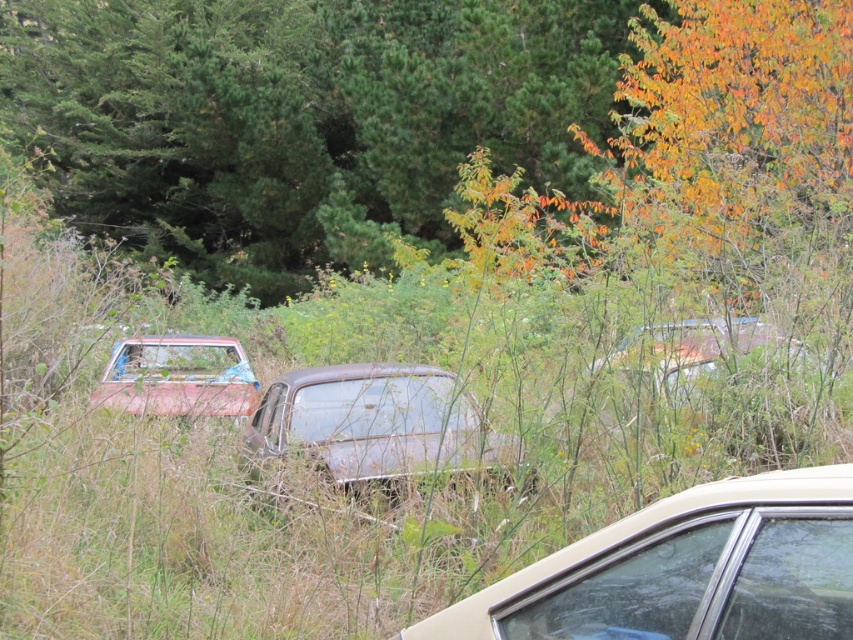
Question: Which object appears closest to the camera in this image?

Choices:
 (A) green matte tree at upper center
 (B) rusty metallic car at center
 (C) rusty metal car at left
 (D) metallic beige sedan at lower right

Answer: (D)

Question: Is rusty metallic car at center closer to camera compared to rusty metal car at left?

Choices:
 (A) no
 (B) yes

Answer: (B)

Question: Which point is closer to the camera taking this photo?

Choices:
 (A) (482, 435)
 (B) (703, 544)

Answer: (B)

Question: Does metallic beige sedan at lower right appear over rusty metal car at left?

Choices:
 (A) yes
 (B) no

Answer: (B)

Question: Which object appears closest to the camera in this image?

Choices:
 (A) rusty metallic car at center
 (B) rusty metal car at left
 (C) metallic beige sedan at lower right

Answer: (C)

Question: Is rusty metallic car at center positioned at the back of rusty metal car at left?

Choices:
 (A) yes
 (B) no

Answer: (B)